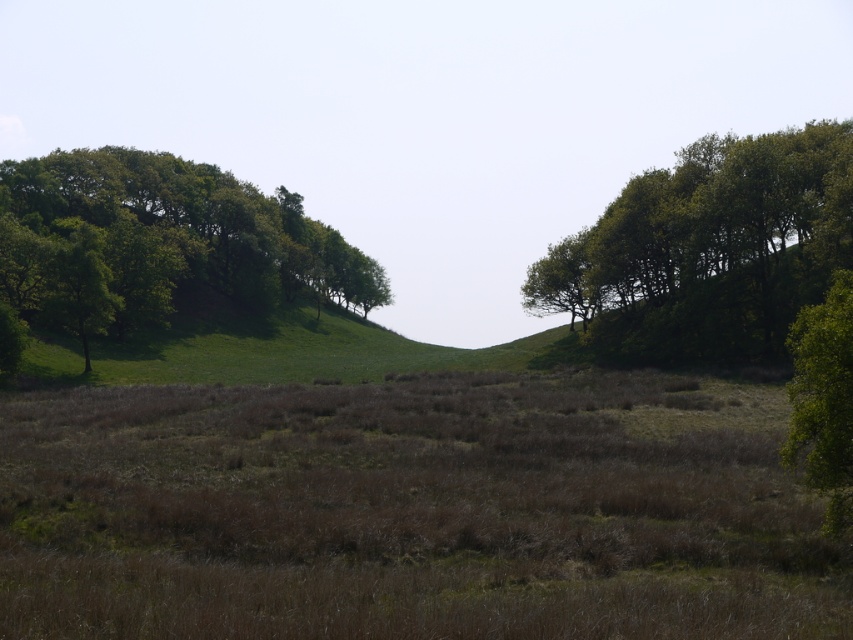
Question: Which of the following is the farthest from the observer?

Choices:
 (A) green leafy tree at upper right
 (B) green leafy tree at upper left

Answer: (B)

Question: Is green leafy tree at upper right to the left of green leafy tree at upper left from the viewer's perspective?

Choices:
 (A) no
 (B) yes

Answer: (A)

Question: Among these objects, which one is nearest to the camera?

Choices:
 (A) green leafy tree at upper right
 (B) green leafy tree at upper left

Answer: (A)

Question: Is green leafy tree at upper right thinner than green leafy tree at upper left?

Choices:
 (A) yes
 (B) no

Answer: (A)

Question: Which of the following is the farthest from the observer?

Choices:
 (A) (730, 144)
 (B) (195, 196)

Answer: (B)

Question: Does green leafy tree at upper right lie in front of green leafy tree at upper left?

Choices:
 (A) yes
 (B) no

Answer: (A)